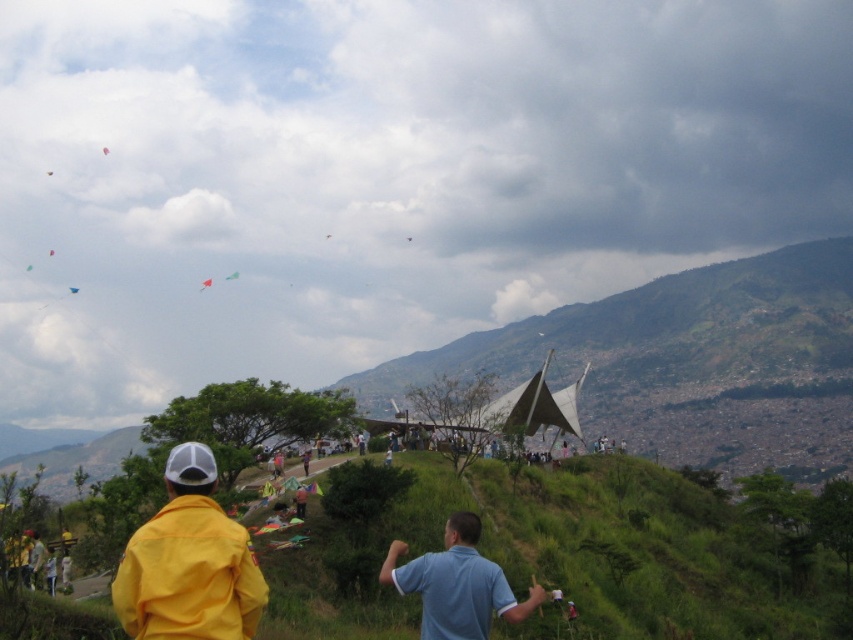
The height and width of the screenshot is (640, 853). Describe the element at coordinates (457, 584) in the screenshot. I see `light blue cotton shirt at center` at that location.

Which is above, light blue cotton shirt at center or light blue shirt at center?

light blue shirt at center is higher up.

Is point (392, 580) positioned in front of point (296, 500)?

Yes, point (392, 580) is in front of point (296, 500).

Locate an element on the screen. light blue cotton shirt at center is located at coordinates (457, 584).

Is yellow matte jacket at lower left to the left of light blue cotton shirt at center from the viewer's perspective?

Yes, yellow matte jacket at lower left is to the left of light blue cotton shirt at center.

You are a GUI agent. You are given a task and a screenshot of the screen. Output one action in this format:
    pyautogui.click(x=<x>, y=<y>)
    Task: Click on the yellow matte jacket at lower left
    This screenshot has height=640, width=853.
    Given the screenshot: What is the action you would take?
    click(189, 563)

Measure the distance between point (68, 288) and camera.

Point (68, 288) is 700.67 meters from camera.

Can you confirm if blue fabric kite at upper left is taller than yellow paper kite at upper left?

Correct, blue fabric kite at upper left is much taller as yellow paper kite at upper left.

Who is more forward, (70, 291) or (50, 170)?

Positioned in front is point (70, 291).

The width and height of the screenshot is (853, 640). I want to click on blue fabric kite at upper left, so click(73, 289).